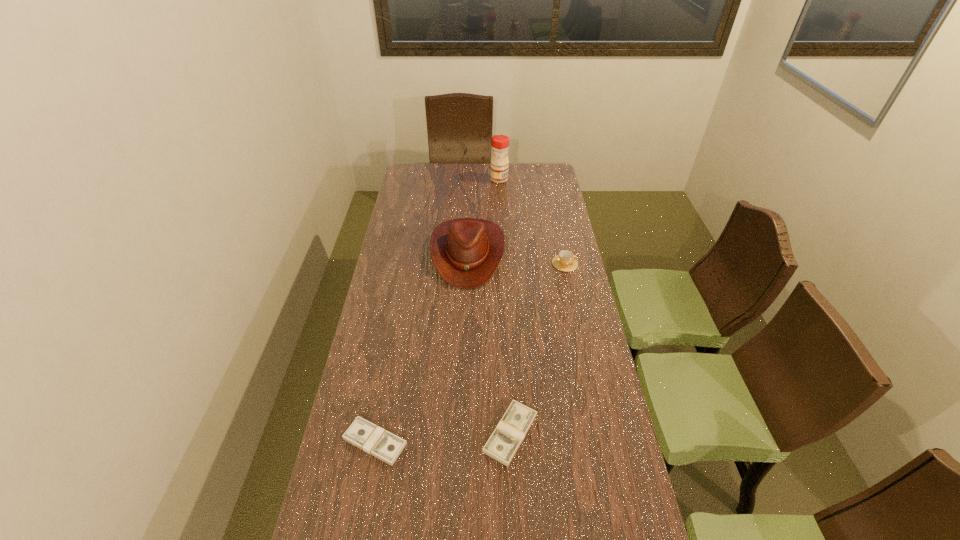
Find the location of `vacant space that is in between the right dollar and the condiment`. vacant space that is in between the right dollar and the condiment is located at coordinates (505, 306).

Where is `vacant region between the right dollar and the cup`? The width and height of the screenshot is (960, 540). vacant region between the right dollar and the cup is located at coordinates (538, 348).

Image resolution: width=960 pixels, height=540 pixels. Identify the location of unoccupied position between the tallest object and the left dollar. click(437, 310).

Locate an element on the screen. Image resolution: width=960 pixels, height=540 pixels. object that stands as the third closest to the cup is located at coordinates point(502,445).

Identify the location of the fourth closest object to the left dollar. The height and width of the screenshot is (540, 960). (500, 143).

Where is `dollar that stands as the closest to the fourth shortest object`? dollar that stands as the closest to the fourth shortest object is located at coordinates (502, 445).

I want to click on free region that satisfies the following two spatial constraints: 1. on the front-facing side of the fourth shortest object; 2. on the left side of the right dollar, so click(462, 433).